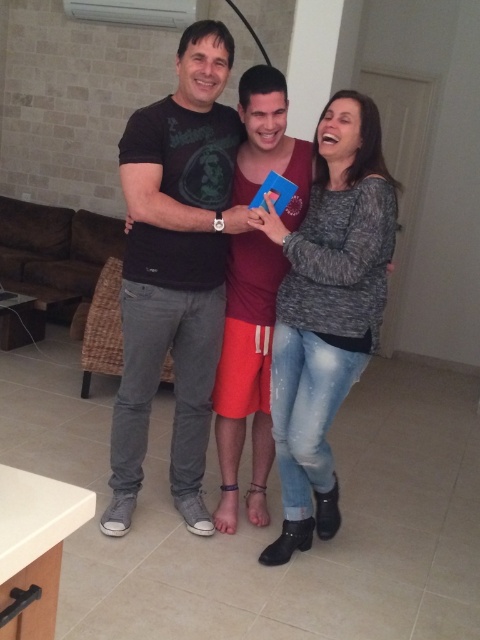
Can you confirm if matte black shirt at center is positioned to the right of matte red shorts at center?

Yes, matte black shirt at center is to the right of matte red shorts at center.

Who is more forward, [316,141] or [273,326]?

Point [316,141] is in front.

At what (x,y) coordinates should I click in order to perform the action: click on matte black shirt at center. Please return your answer as a coordinate pair (x, y). Looking at the image, I should click on (247, 365).

Can you confirm if black matte t-shirt at center is wider than matte red shorts at center?

Yes, black matte t-shirt at center is wider than matte red shorts at center.

How distant is black matte t-shirt at center from matte red shorts at center?

black matte t-shirt at center is 8.20 inches from matte red shorts at center.

Measure the distance between black matte t-shirt at center and camera.

black matte t-shirt at center and camera are 2.02 meters apart from each other.

Where is `black matte t-shirt at center`? black matte t-shirt at center is located at coordinates (175, 269).

Which is more to the right, gray knit sweater at center or matte black shirt at center?

gray knit sweater at center

What do you see at coordinates (326, 308) in the screenshot? I see `gray knit sweater at center` at bounding box center [326, 308].

Image resolution: width=480 pixels, height=640 pixels. I want to click on gray knit sweater at center, so click(326, 308).